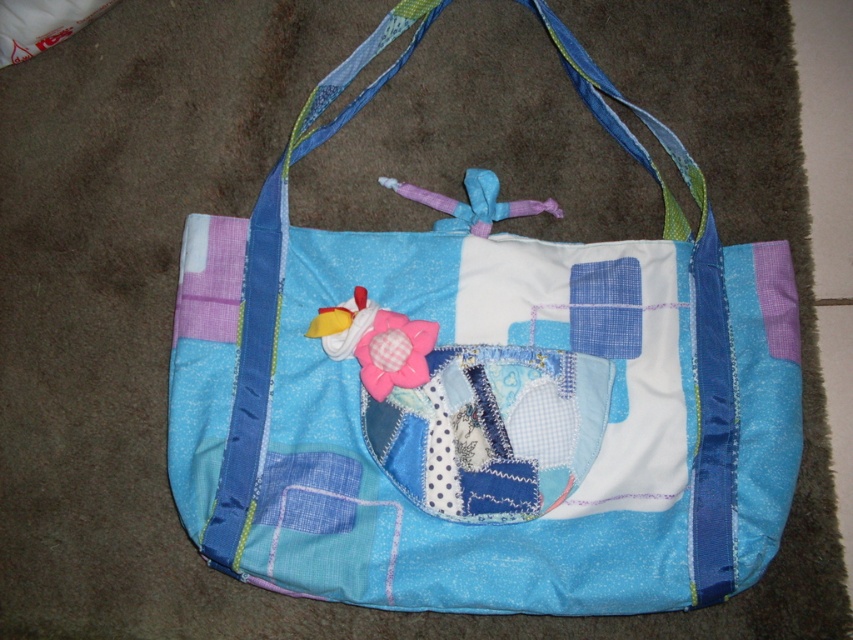
Question: Can you confirm if patchwork fabric shoulder bag at center is positioned to the left of patchwork fabric pocket at center?

Choices:
 (A) yes
 (B) no

Answer: (B)

Question: Does patchwork fabric shoulder bag at center have a lesser width compared to patchwork fabric pocket at center?

Choices:
 (A) yes
 (B) no

Answer: (B)

Question: Does patchwork fabric shoulder bag at center appear on the left side of patchwork fabric pocket at center?

Choices:
 (A) no
 (B) yes

Answer: (A)

Question: Which point appears closest to the camera in this image?

Choices:
 (A) (564, 394)
 (B) (384, 77)

Answer: (A)

Question: Which point is closer to the camera taking this photo?

Choices:
 (A) (392, 396)
 (B) (532, 444)

Answer: (B)